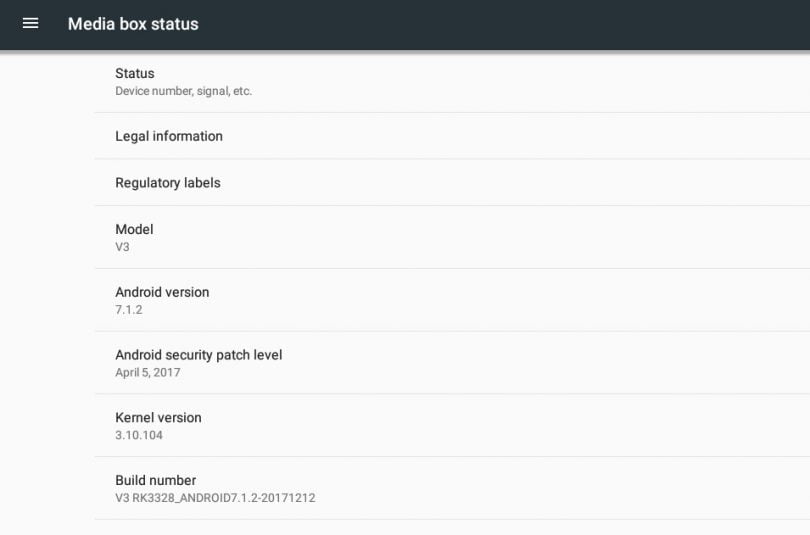
Find the location of `box`. box is located at coordinates (133, 40).